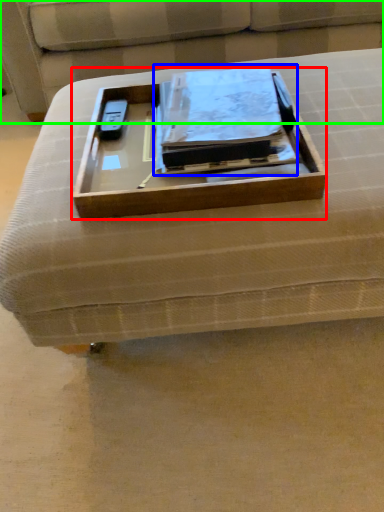
Question: Estimate the real-world distances between objects in this image. Which object is closer to box (highlighted by a red box), binder (highlighted by a blue box) or couch (highlighted by a green box)?

Choices:
 (A) binder
 (B) couch

Answer: (A)